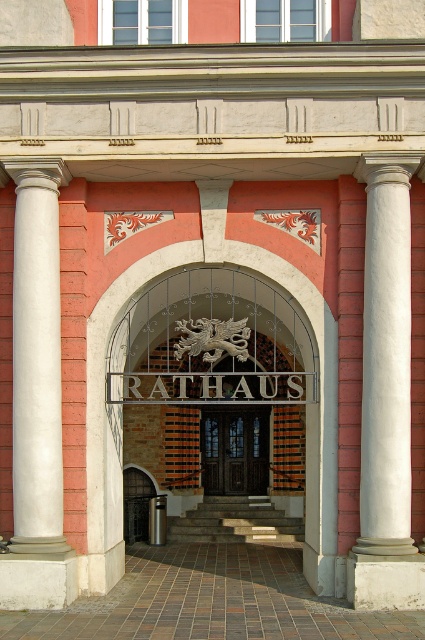
Describe the element at coordinates (385, 396) in the screenshot. I see `white marble column at center` at that location.

Is white marble column at center wider than dark wood door at center?

No.

This screenshot has height=640, width=425. What do you see at coordinates (385, 396) in the screenshot?
I see `white marble column at center` at bounding box center [385, 396].

I want to click on white marble column at center, so [385, 396].

Does white marble column at left have a larger size compared to dark wood door at center?

Indeed, white marble column at left has a larger size compared to dark wood door at center.

Is white marble column at left positioned behind dark wood door at center?

No, it is in front of dark wood door at center.

Who is more forward, (x=16, y=486) or (x=224, y=480)?

Point (x=16, y=486) is in front.

The height and width of the screenshot is (640, 425). I want to click on white marble column at left, so click(x=36, y=358).

Is white marble column at center above white marble column at left?

No.

Who is positioned more to the left, white marble column at center or white marble column at left?

From the viewer's perspective, white marble column at left appears more on the left side.

Identify the location of white marble column at center. (385, 396).

At what (x,y) coordinates should I click in order to perform the action: click on white marble column at center. Please return your answer as a coordinate pair (x, y). Looking at the image, I should click on (385, 396).